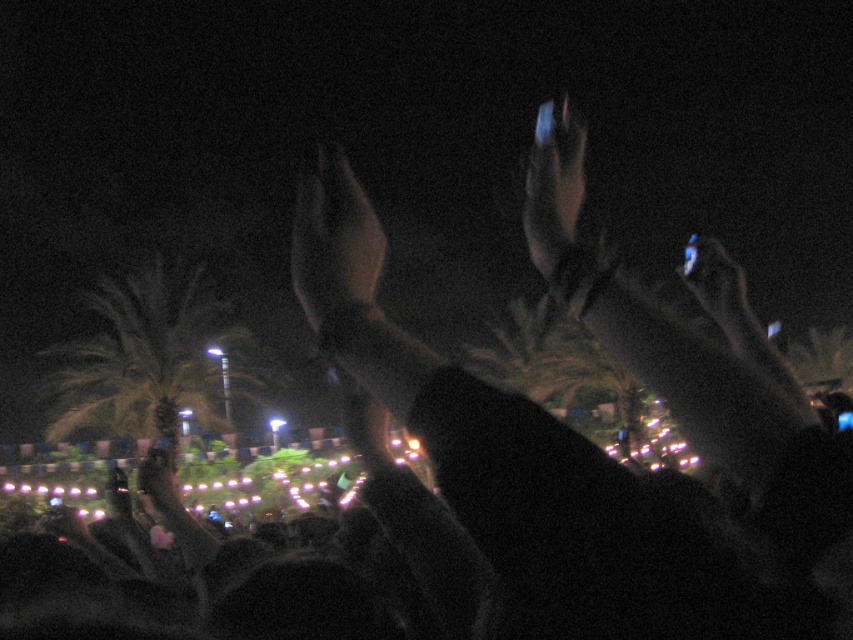
Question: Observing the image, what is the correct spatial positioning of black matte hands at upper center in reference to shiny metallic hand at upper center?

Choices:
 (A) above
 (B) below

Answer: (B)

Question: Which of these objects is positioned closest to the matte black hand at center?

Choices:
 (A) shiny metallic hand at upper center
 (B) green leafy palm tree at left
 (C) black matte hands at upper center

Answer: (C)

Question: Does black matte hands at upper center appear on the left side of matte black hand at center?

Choices:
 (A) no
 (B) yes

Answer: (A)

Question: Which of these objects is positioned closest to the matte black hand at center?

Choices:
 (A) green leafy palm tree at left
 (B) shiny metallic hand at upper center

Answer: (B)

Question: Can you confirm if black matte hands at upper center is smaller than matte black hand at center?

Choices:
 (A) yes
 (B) no

Answer: (A)

Question: Which point appears closest to the camera in this image?

Choices:
 (A) (358, 208)
 (B) (746, 435)
 (C) (537, 260)

Answer: (B)